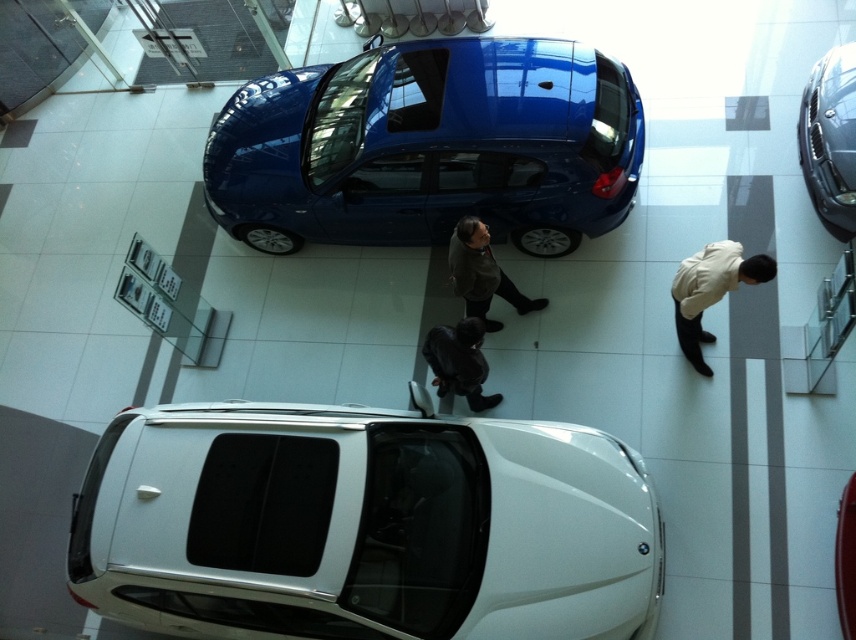
You are a customer in the car showroom and want to approach the white glossy suv at lower center. Currently, you are standing next to the white matte jacket at lower right. Can you walk directly to the suv without moving around any obstacles?

The white glossy suv at lower center is located below the white matte jacket at lower right, meaning it is positioned closer to the ground. Since the jacket is at lower right and the SUV is below it, there might be a vertical obstacle like a display stand or a person blocking the path. However, since the SUV is in the foreground and the jacket is further back, you can likely walk around the jacket to reach the SUV.

You are a salesperson in the car showroom. You need to approach the person wearing the white matte jacket at lower right and the person in the dark green sweater at center. Which person should you approach first to reach them without walking behind anyone?

You should approach the white matte jacket at lower right first because it is in front of the dark green sweater at center, so you can reach them without needing to walk behind anyone.